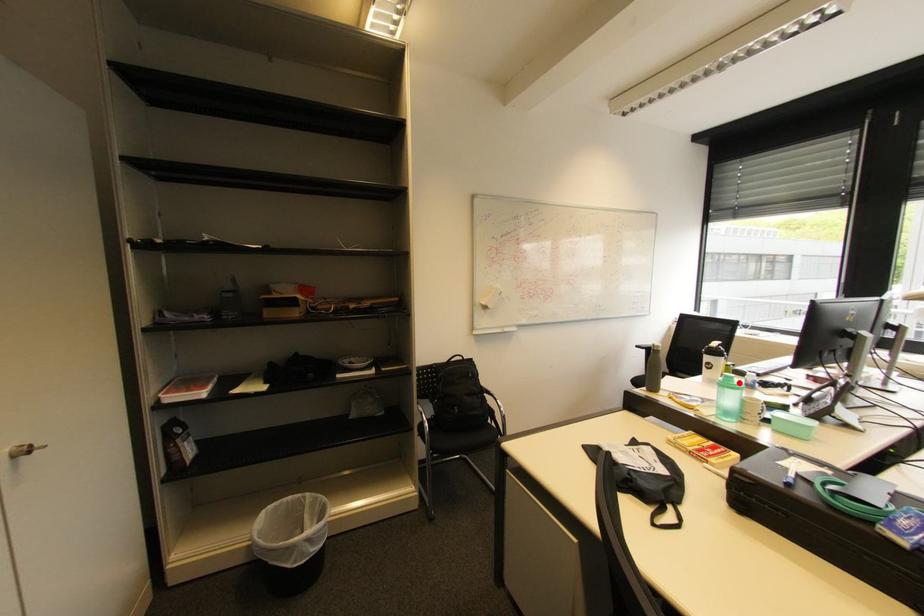
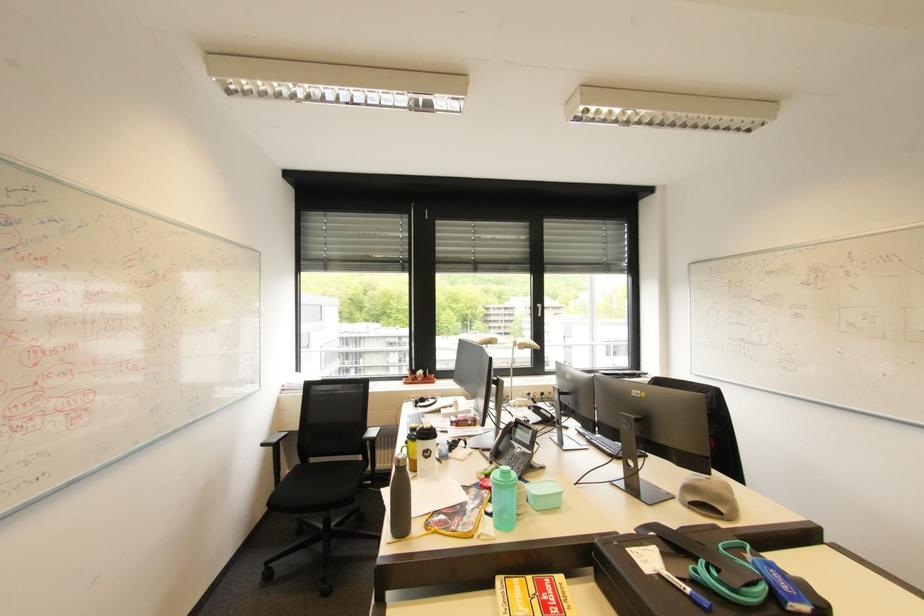
Question: A red point is marked in image1. In image2, is the corresponding 3D point closer to the camera or farther? Reply with the corresponding letter.

Choices:
 (A) The corresponding 3D point is closer.
 (B) The corresponding 3D point is farther.

Answer: (A)